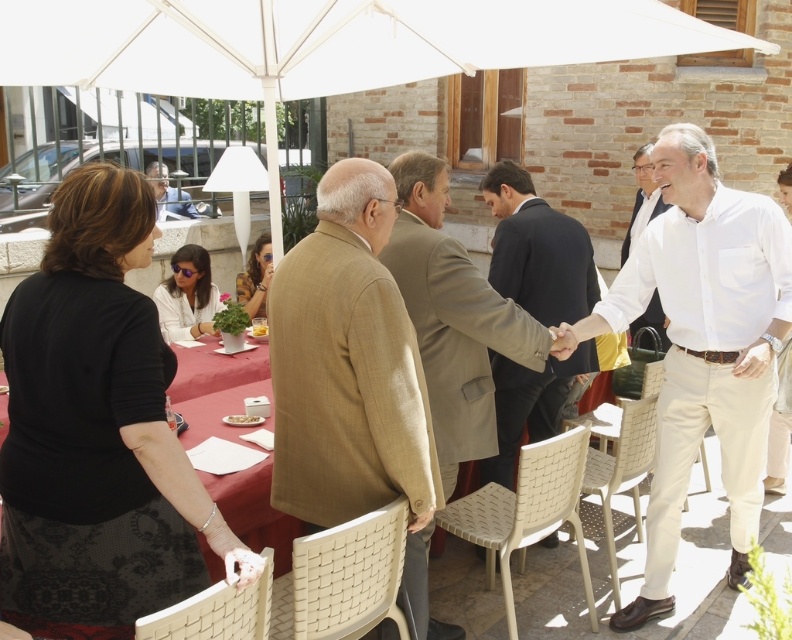
Between point (743, 392) and point (638, 209), which one is positioned in front?

Point (743, 392) is in front.

Does white cotton shirt at center have a greater height compared to white cotton shirt at upper right?

Yes, white cotton shirt at center is taller than white cotton shirt at upper right.

This screenshot has width=792, height=640. Describe the element at coordinates (703, 346) in the screenshot. I see `white cotton shirt at center` at that location.

You are a GUI agent. You are given a task and a screenshot of the screen. Output one action in this format:
    pyautogui.click(x=<x>, y=<y>)
    Task: Click on the white cotton shirt at center
    This screenshot has width=792, height=640.
    Given the screenshot: What is the action you would take?
    pyautogui.click(x=703, y=346)

Between yellow floral blouse at center and white matte plate at center, which one appears on the right side from the viewer's perspective?

Positioned to the right is white matte plate at center.

Which of these two, yellow floral blouse at center or white matte plate at center, stands shorter?

Standing shorter between the two is white matte plate at center.

This screenshot has width=792, height=640. Find the location of `yellow floral blouse at center`. yellow floral blouse at center is located at coordinates (254, 276).

Who is positioned more to the right, dark suit at center or matte black dress at center?

matte black dress at center is more to the right.

Can you confirm if dark suit at center is wider than matte black dress at center?

Indeed, dark suit at center has a greater width compared to matte black dress at center.

Find the location of a particular element. dark suit at center is located at coordinates (537, 250).